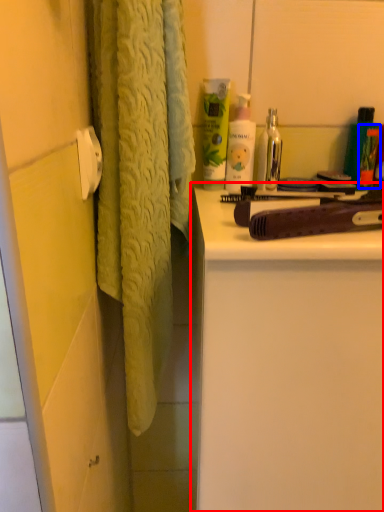
Question: Which object appears farthest to the camera in this image, bathroom cabinet (highlighted by a red box) or toiletry (highlighted by a blue box)?

Choices:
 (A) bathroom cabinet
 (B) toiletry

Answer: (B)